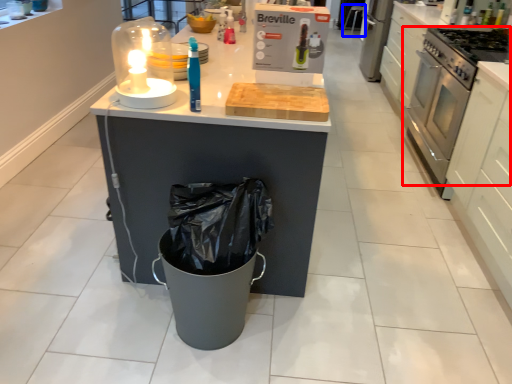
Question: Which of the following is the closest to the observer, home appliance (highlighted by a red box) or bar stool (highlighted by a blue box)?

Choices:
 (A) home appliance
 (B) bar stool

Answer: (A)